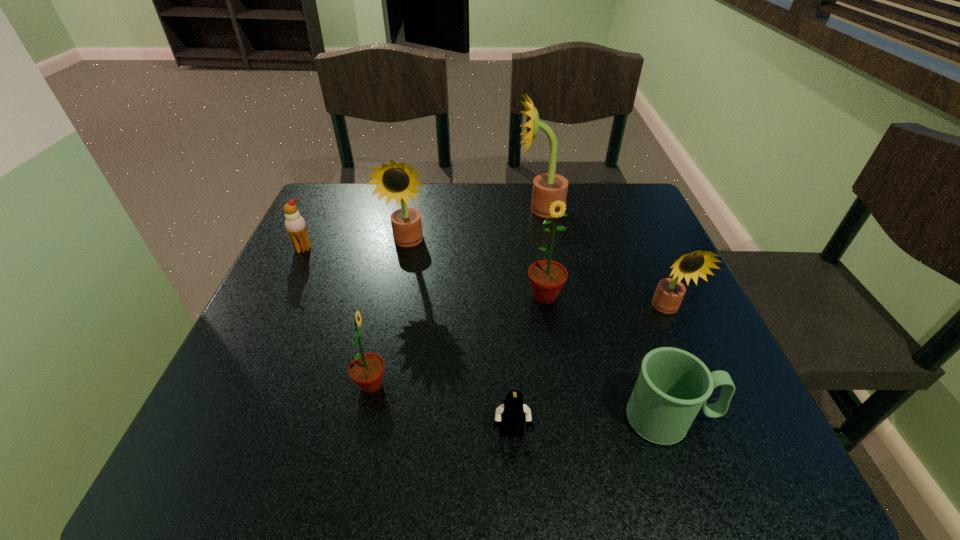
The image size is (960, 540). What are the coordinates of `empty space between the icecream and the bigger green sunflower` in the screenshot? It's located at (424, 273).

The height and width of the screenshot is (540, 960). In order to click on vacant point located between the bigger green sunflower and the smaller green sunflower in this screenshot , I will do `click(458, 341)`.

Where is `empty space that is in between the icecream and the nearest yellow sunflower`? Image resolution: width=960 pixels, height=540 pixels. empty space that is in between the icecream and the nearest yellow sunflower is located at coordinates (485, 279).

Locate which object ranks third in proximity to the second farthest sunflower. Please provide its 2D coordinates. Your answer should be formatted as a tuple, i.e. [(x, y)], where the tuple contains the x and y coordinates of a point satisfying the conditions above.

[(547, 277)]

Locate which object is the fourth closest to the green mug. Please provide its 2D coordinates. Your answer should be formatted as a tuple, i.e. [(x, y)], where the tuple contains the x and y coordinates of a point satisfying the conditions above.

[(366, 370)]

Locate which sunflower ranks second in proximity to the green mug. Please provide its 2D coordinates. Your answer should be formatted as a tuple, i.e. [(x, y)], where the tuple contains the x and y coordinates of a point satisfying the conditions above.

[(547, 277)]

Identify which sunflower is the fourth closest to the green mug. Please provide its 2D coordinates. Your answer should be formatted as a tuple, i.e. [(x, y)], where the tuple contains the x and y coordinates of a point satisfying the conditions above.

[(547, 187)]

Locate an element on the screen. This screenshot has height=540, width=960. yellow sunflower that is the third closest to the icecream is located at coordinates (669, 293).

Identify the location of yellow sunflower that is the second closest to the nearest sunflower. The width and height of the screenshot is (960, 540). pos(669,293).

You are a GUI agent. You are given a task and a screenshot of the screen. Output one action in this format:
    pyautogui.click(x=<x>, y=<y>)
    Task: Click on the free space that satisfies the following two spatial constraints: 1. on the face of the second biggest yellow sunflower; 2. on the face of the smaller green sunflower
    
    Given the screenshot: What is the action you would take?
    pyautogui.click(x=379, y=385)